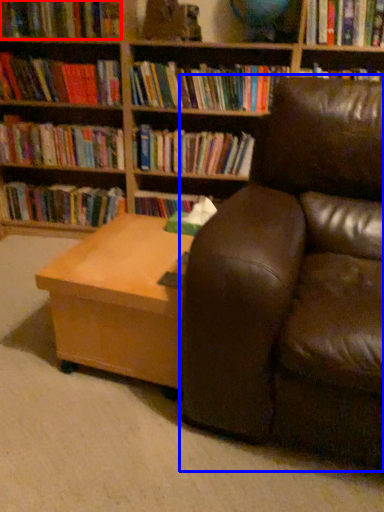
Question: Which object appears farthest to the camera in this image, book (highlighted by a red box) or studio couch (highlighted by a blue box)?

Choices:
 (A) book
 (B) studio couch

Answer: (A)